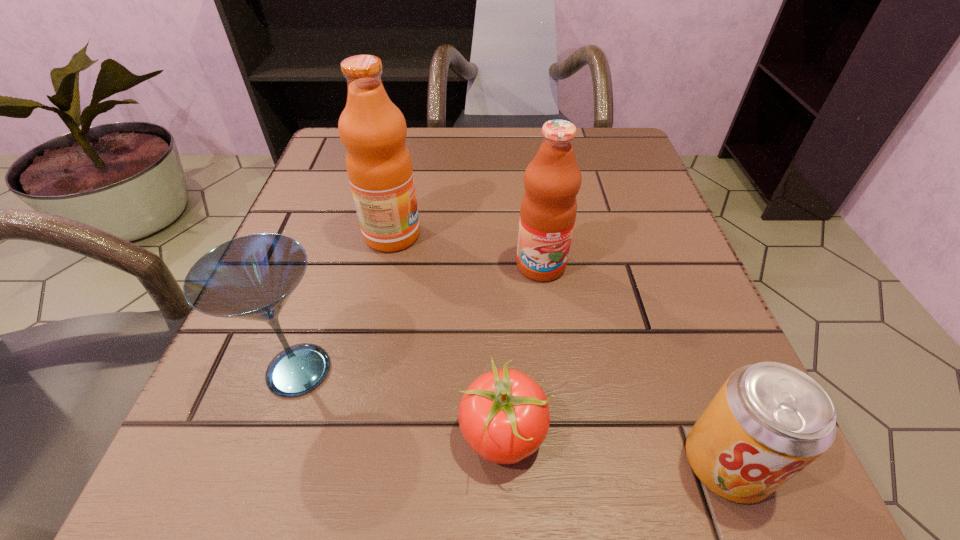
Find the location of a particular element. free space between the third tallest object and the taller fruit juice is located at coordinates (346, 303).

At what (x,y) coordinates should I click in order to perform the action: click on free space between the martini and the tallest object. Please return your answer as a coordinate pair (x, y). Looking at the image, I should click on (346, 303).

You are a GUI agent. You are given a task and a screenshot of the screen. Output one action in this format:
    pyautogui.click(x=<x>, y=<y>)
    Task: Click on the free area in between the martini and the tallest object
    Image resolution: width=960 pixels, height=540 pixels.
    Given the screenshot: What is the action you would take?
    pos(346,303)

This screenshot has height=540, width=960. In order to click on empty space that is in between the tomato and the taller fruit juice in this screenshot , I will do coord(447,334).

Identify the location of vacant area that lies between the rightmost object and the right fruit juice. (634, 364).

Image resolution: width=960 pixels, height=540 pixels. What are the coordinates of `the fourth closest object to the shorter fruit juice` in the screenshot? It's located at (251, 277).

Locate an element on the screen. The width and height of the screenshot is (960, 540). object that ranks as the second closest to the third tallest object is located at coordinates (373, 130).

Locate an element on the screen. This screenshot has width=960, height=540. blank area in the image that satisfies the following two spatial constraints: 1. on the front label of the fourth tallest object; 2. on the right side of the second tallest object is located at coordinates (568, 462).

Locate an element on the screen. The width and height of the screenshot is (960, 540). free space that satisfies the following two spatial constraints: 1. on the front side of the pop (soda); 2. on the left side of the martini is located at coordinates [x=269, y=462].

The width and height of the screenshot is (960, 540). Find the location of `blank area in the image that satisfies the following two spatial constraints: 1. on the label side of the tallest object; 2. on the front side of the martini`. blank area in the image that satisfies the following two spatial constraints: 1. on the label side of the tallest object; 2. on the front side of the martini is located at coordinates 364,370.